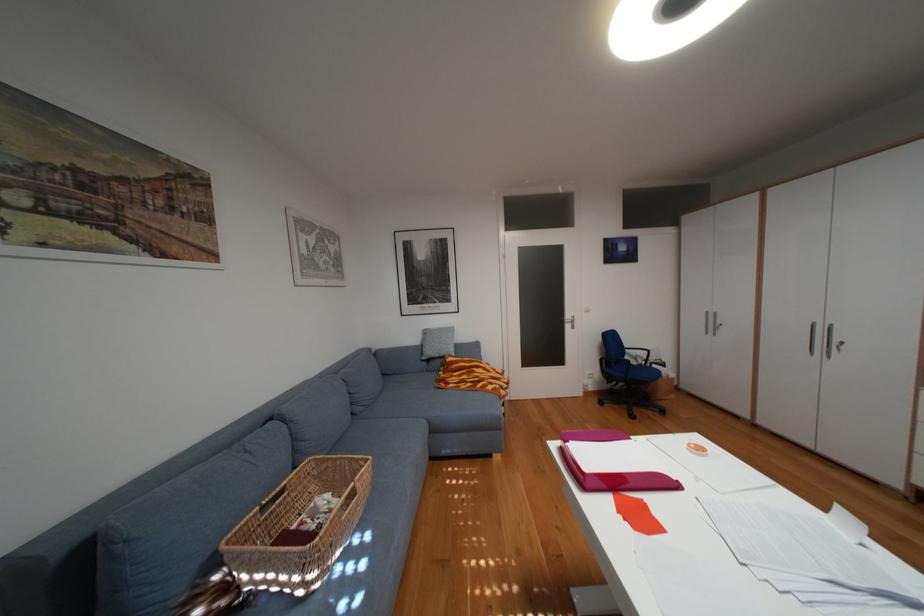
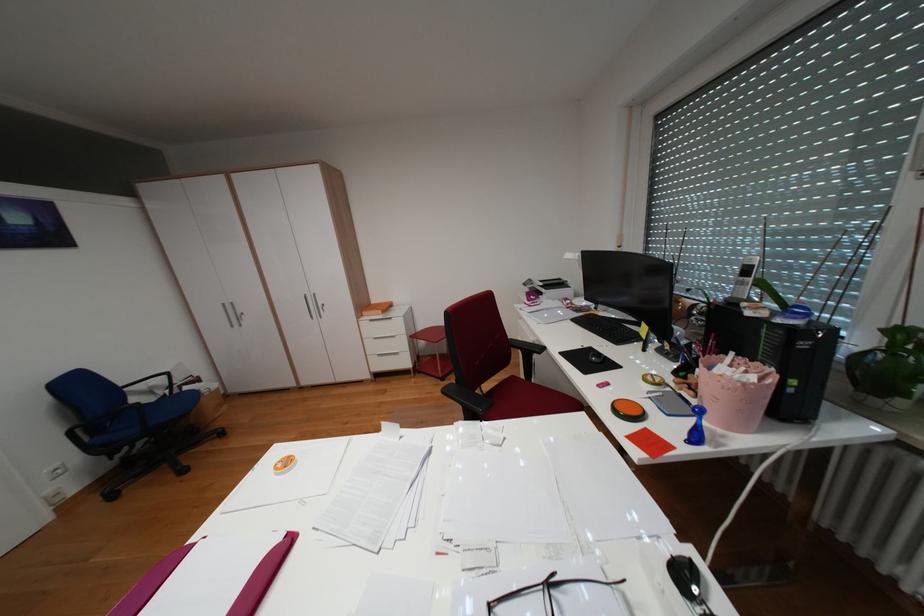
Question: The images are taken continuously from a first-person perspective. In which direction is your viewpoint rotating?

Choices:
 (A) Left
 (B) Right
 (C) Up
 (D) Down

Answer: (B)